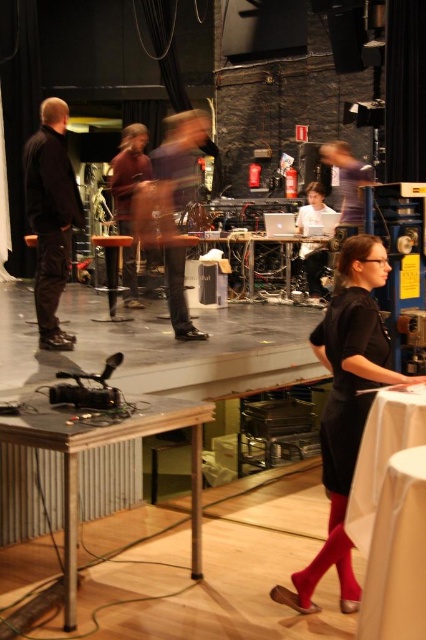
Is dark brown leather pants at left thinner than brown leather jacket at center?

Incorrect, dark brown leather pants at left's width is not less than brown leather jacket at center's.

Is dark brown leather pants at left wider than brown leather jacket at center?

Yes.

You are a GUI agent. You are given a task and a screenshot of the screen. Output one action in this format:
    pyautogui.click(x=<x>, y=<y>)
    Task: Click on the dark brown leather pants at left
    The height and width of the screenshot is (640, 426).
    Given the screenshot: What is the action you would take?
    pyautogui.click(x=51, y=216)

Which of these two, wooden table at lower left or dark brown leather pants at left, stands shorter?

Standing shorter between the two is wooden table at lower left.

At what (x,y) coordinates should I click in order to perform the action: click on wooden table at lower left. Please return your answer as a coordinate pair (x, y). This screenshot has height=640, width=426. Looking at the image, I should click on (106, 444).

Can you confirm if dark brown leather pants at left is thinner than dark brown leather shoes at center?

No, dark brown leather pants at left is not thinner than dark brown leather shoes at center.

The height and width of the screenshot is (640, 426). Describe the element at coordinates (51, 216) in the screenshot. I see `dark brown leather pants at left` at that location.

Locate an element on the screen. This screenshot has width=426, height=640. dark brown leather pants at left is located at coordinates (51, 216).